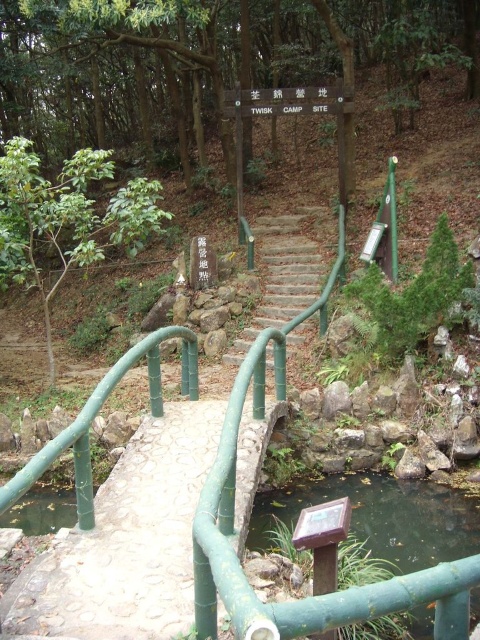
Question: Can you confirm if green bamboo stream at lower center is positioned above green bamboo stairs at center?

Choices:
 (A) no
 (B) yes

Answer: (A)

Question: Can you confirm if green bamboo stream at lower center is thinner than green bamboo stairs at center?

Choices:
 (A) no
 (B) yes

Answer: (A)

Question: Can you confirm if green bamboo stream at lower center is positioned to the left of green bamboo stairs at center?

Choices:
 (A) no
 (B) yes

Answer: (A)

Question: Which object is closer to the camera taking this photo?

Choices:
 (A) green bamboo stream at lower center
 (B) green bamboo stairs at center

Answer: (A)

Question: Among these points, which one is farthest from the camera?

Choices:
 (A) (424, 628)
 (B) (254, 227)

Answer: (B)